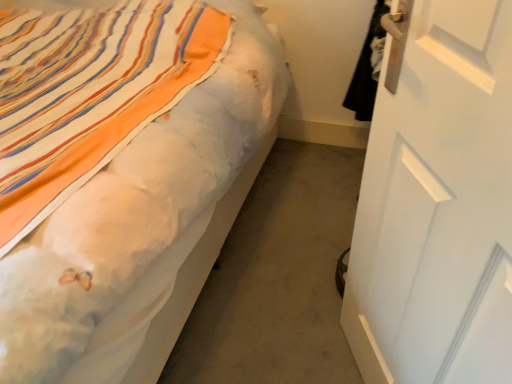
What do you see at coordinates (137, 220) in the screenshot?
I see `matte white bed at center` at bounding box center [137, 220].

What is the approximate width of matte white bed at center?

It is 1.89 meters.

Find the location of a particular element. The image size is (512, 384). matte white bed at center is located at coordinates (137, 220).

The width and height of the screenshot is (512, 384). What do you see at coordinates (437, 202) in the screenshot?
I see `white matte door at right` at bounding box center [437, 202].

In order to click on white matte door at right in this screenshot , I will do `click(437, 202)`.

Locate an element on the screen. This screenshot has width=512, height=384. matte white bed at center is located at coordinates (137, 220).

Considering the relative positions of matte white bed at center and white matte door at right in the image provided, is matte white bed at center to the right of white matte door at right from the viewer's perspective?

In fact, matte white bed at center is to the left of white matte door at right.

Is matte white bed at center closer to camera compared to white matte door at right?

No, matte white bed at center is further to the viewer.

Considering the positions of point (187, 226) and point (355, 243), is point (187, 226) closer or farther from the camera than point (355, 243)?

Point (187, 226) is farther from the camera than point (355, 243).

From the image's perspective, is matte white bed at center below white matte door at right?

No, from the image's perspective, matte white bed at center is not below white matte door at right.

From a real-world perspective, is matte white bed at center under white matte door at right?

Yes.

Can you confirm if matte white bed at center is wider than white matte door at right?

Indeed, matte white bed at center has a greater width compared to white matte door at right.

In terms of height, does matte white bed at center look taller or shorter compared to white matte door at right?

Considering their sizes, matte white bed at center has less height than white matte door at right.

Who is bigger, matte white bed at center or white matte door at right?

Bigger between the two is matte white bed at center.

Is matte white bed at center completely or partially outside of white matte door at right?

matte white bed at center is positioned outside white matte door at right.

Is matte white bed at center not near white matte door at right?

No, matte white bed at center is in close proximity to white matte door at right.

Does matte white bed at center turn towards white matte door at right?

No, matte white bed at center is not aimed at white matte door at right.

Identify the location of door above the matte white bed at center (from a real-world perspective). (437, 202).

Is white matte door at right at the left side of matte white bed at center?

In fact, white matte door at right is to the right of matte white bed at center.

Is white matte door at right further to camera compared to matte white bed at center?

No, the depth of white matte door at right is less than that of matte white bed at center.

Considering the positions of points (489, 306) and (119, 160), is point (489, 306) closer to camera compared to point (119, 160)?

Yes, it is in front of point (119, 160).

From the image's perspective, is white matte door at right positioned above or below matte white bed at center?

white matte door at right is below matte white bed at center.

From a real-world perspective, which object stands above the other?

white matte door at right.

Is white matte door at right wider than matte white bed at center?

No, white matte door at right is not wider than matte white bed at center.

Is white matte door at right taller than matte white bed at center?

Yes, white matte door at right is taller than matte white bed at center.

Looking at this image, which of these two, white matte door at right or matte white bed at center, is bigger?

matte white bed at center is bigger.

Is white matte door at right positioned beyond the bounds of matte white bed at center?

Yes, white matte door at right is located beyond the bounds of matte white bed at center.

Are white matte door at right and matte white bed at center beside each other?

white matte door at right and matte white bed at center are not in contact.

Is white matte door at right turned away from matte white bed at center?

white matte door at right is not turned away from matte white bed at center.

You are a GUI agent. You are given a task and a screenshot of the screen. Output one action in this format:
    pyautogui.click(x=<x>, y=<y>)
    Task: Click on the door positioned vertically above the matte white bed at center (from a real-world perspective)
    Image resolution: width=512 pixels, height=384 pixels.
    Given the screenshot: What is the action you would take?
    pyautogui.click(x=437, y=202)

Find the location of `door below the matte white bed at center (from the image's perspective)`. door below the matte white bed at center (from the image's perspective) is located at coordinates (437, 202).

At what (x,y) coordinates should I click in order to perform the action: click on door that is above the matte white bed at center (from a real-world perspective). Please return your answer as a coordinate pair (x, y). This screenshot has width=512, height=384. Looking at the image, I should click on (437, 202).